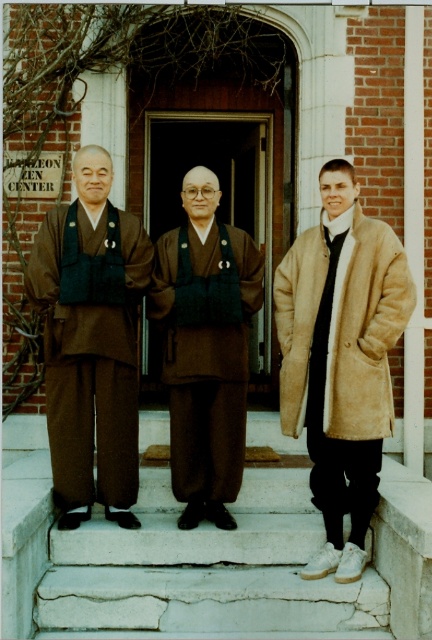
Which is more to the left, brown matte kimono at center or suede beige coat at right?

From the viewer's perspective, brown matte kimono at center appears more on the left side.

Does point (104, 394) come in front of point (374, 365)?

No, it is behind (374, 365).

The height and width of the screenshot is (640, 432). I want to click on brown matte kimono at center, so click(x=91, y=340).

Can you confirm if white stone stairs at center is positioned below brown woolen robe at center?

Yes.

Describe the element at coordinates (206, 557) in the screenshot. The height and width of the screenshot is (640, 432). I see `white stone stairs at center` at that location.

Where is `white stone stairs at center`? Image resolution: width=432 pixels, height=640 pixels. white stone stairs at center is located at coordinates (206, 557).

Does white stone stairs at center have a larger size compared to brown matte kimono at center?

Yes, white stone stairs at center is bigger than brown matte kimono at center.

Which is behind, point (380, 540) or point (73, 314)?

The point (73, 314) is more distant.

Where is `white stone stairs at center`? The width and height of the screenshot is (432, 640). white stone stairs at center is located at coordinates (206, 557).

Identify the location of white stone stairs at center. (206, 557).